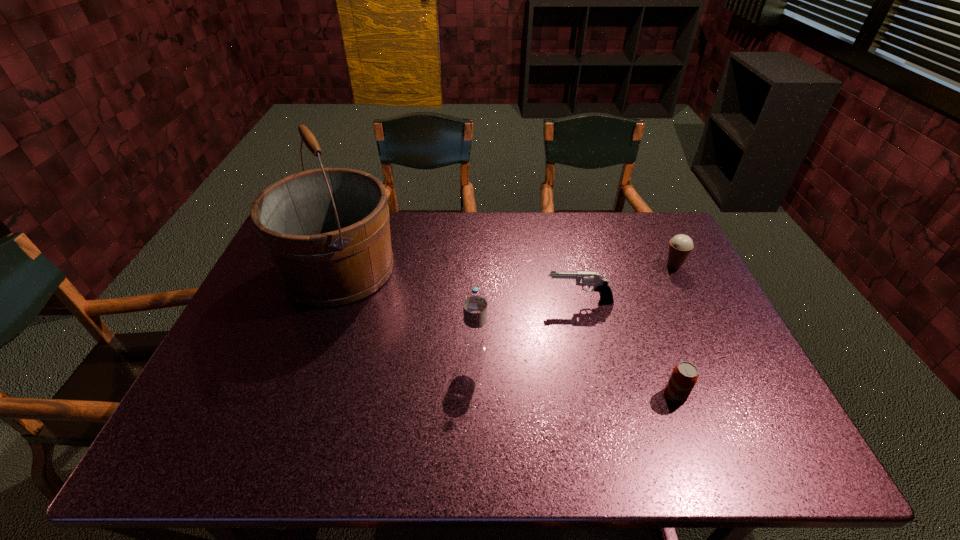
The image size is (960, 540). In order to click on the tallest object in this screenshot , I will do tap(326, 231).

Locate an element on the screen. This screenshot has height=540, width=960. bucket is located at coordinates (326, 231).

You are a GUI agent. You are given a task and a screenshot of the screen. Output one action in this format:
    pyautogui.click(x=<x>, y=<y>)
    Task: Click on the second tallest object
    The width and height of the screenshot is (960, 540).
    Given the screenshot: What is the action you would take?
    pyautogui.click(x=475, y=302)

At what (x,y) coordinates should I click in order to perform the action: click on the fourth farthest object. Please return your answer as a coordinate pair (x, y). The width and height of the screenshot is (960, 540). Looking at the image, I should click on (475, 302).

This screenshot has width=960, height=540. What are the coordinates of `icecream` in the screenshot? It's located at (680, 246).

This screenshot has height=540, width=960. Find the location of `gun`. gun is located at coordinates (600, 284).

You are a GUI agent. You are given a task and a screenshot of the screen. Output one action in this format:
    pyautogui.click(x=<x>, y=<y>)
    Task: Click on the second object from right to left
    This screenshot has width=960, height=540.
    Given the screenshot: What is the action you would take?
    pyautogui.click(x=684, y=376)

At what (x,y) coordinates should I click in order to perform the action: click on the nearest object. Please return your answer as a coordinate pair (x, y). This screenshot has height=540, width=960. Looking at the image, I should click on pyautogui.click(x=684, y=376).

The image size is (960, 540). Find the location of `vacant space situated 0.080m on the back of the bucket`. vacant space situated 0.080m on the back of the bucket is located at coordinates (356, 221).

Locate an element on the screen. Image resolution: width=960 pixels, height=540 pixels. free space located on the right of the water bottle is located at coordinates (545, 350).